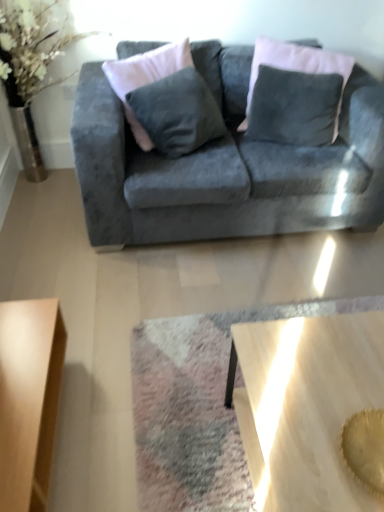
At what (x,y) coordinates should I click in order to perform the action: click on empty space that is to the right of light brown wooden coffee table at lower left, which ranks as the 2th coffee table in right-to-left order. Please return your answer as a coordinate pair (x, y). Looking at the image, I should click on (134, 424).